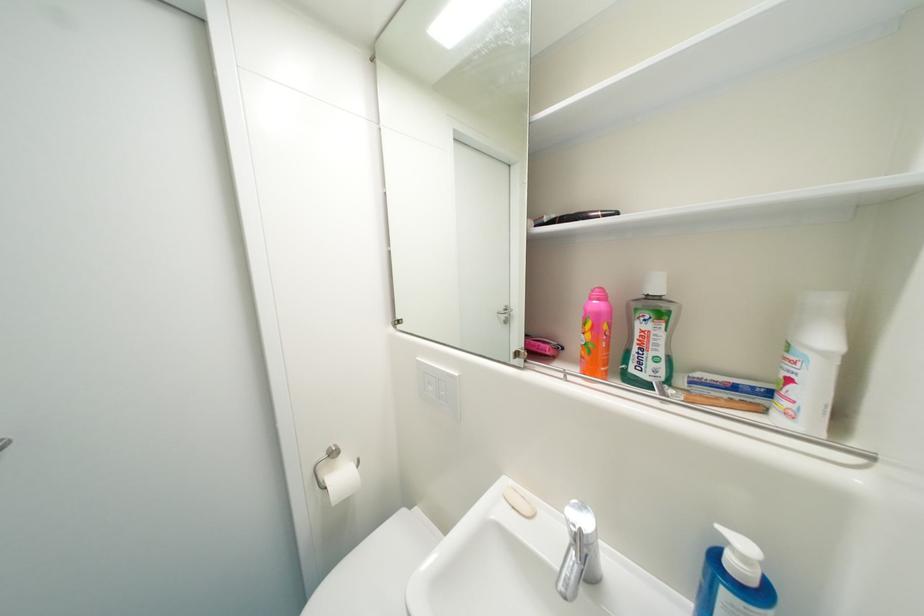
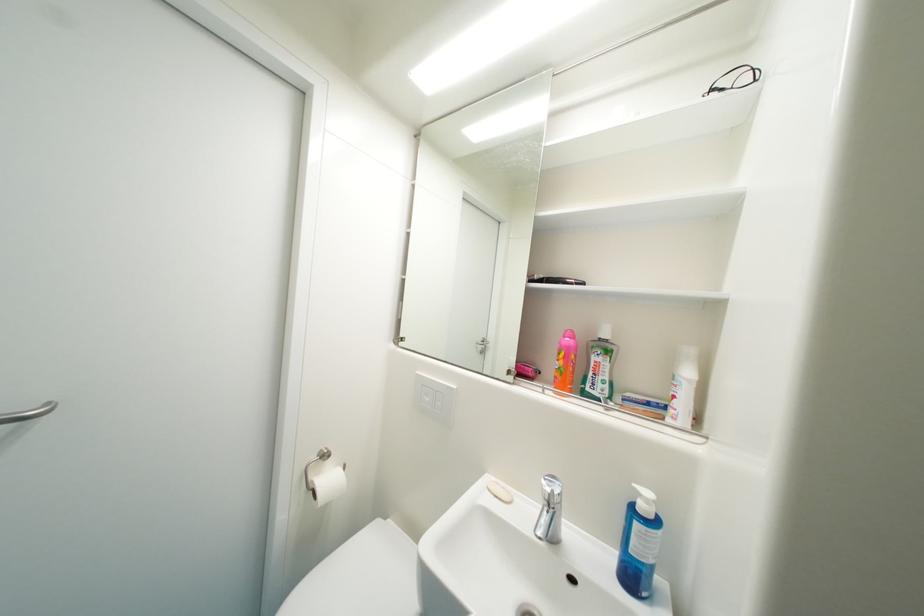
Locate, in the second image, the point that corresponds to point 598,347 in the first image.

(569, 371)